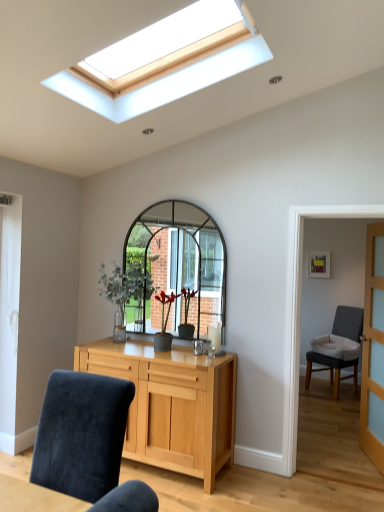
This screenshot has height=512, width=384. I want to click on vacant area to the left of clear glass door at right, so click(340, 460).